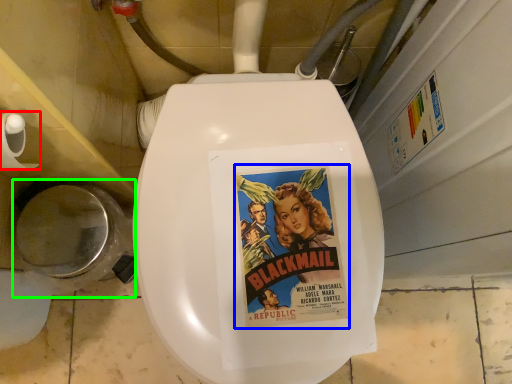
Question: Which object is positioned closest to toilet paper (highlighted by a red box)? Select from fiction book (highlighted by a blue box) and toilet bowl (highlighted by a green box).

Choices:
 (A) fiction book
 (B) toilet bowl

Answer: (B)